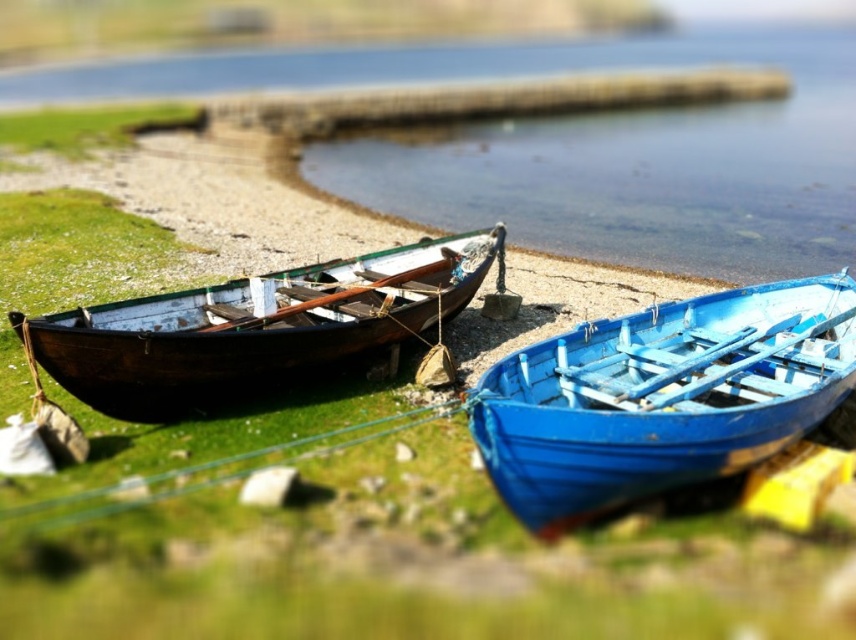
Which is in front, point (704, 353) or point (27, 326)?

Point (27, 326) is in front.

Which is behind, point (756, 291) or point (90, 390)?

Positioned behind is point (756, 291).

This screenshot has height=640, width=856. What are the coordinates of `blue matte boat at lower right` in the screenshot? It's located at (663, 396).

You are a GUI agent. You are given a task and a screenshot of the screen. Output one action in this format:
    pyautogui.click(x=<x>, y=<y>)
    Task: Click on the blue matte boat at lower right
    
    Given the screenshot: What is the action you would take?
    pyautogui.click(x=663, y=396)